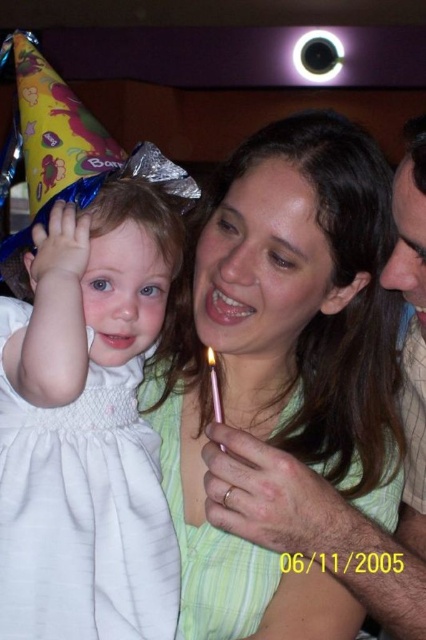
You are a photographer at a birthday party. You need to position the green striped dress at center and the white satin dress at left in a group photo. Which dress should be placed in the back to ensure both are visible?

The green striped dress at center is much taller than the white satin dress at left, so the green striped dress at center should be placed in the back to ensure both are visible.

You are a photographer trying to capture a closeup shot of the birthday child. You are currently positioned at point (201, 595). The birthday child is at point (216, 380). Can you move closer to the child without moving past their position?

Point (201, 595) is further to the viewer than point (216, 380). Therefore, you can move closer to the child without passing their position.